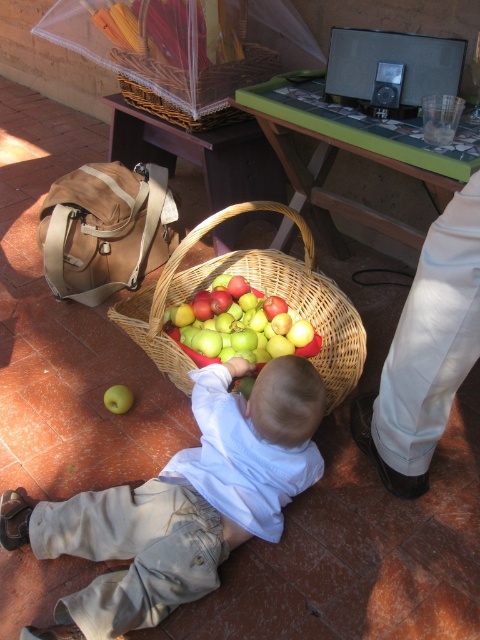
Looking at this image, which is more to the right, light beige cotton pants at lower left or green matte apple at lower left?

From the viewer's perspective, light beige cotton pants at lower left appears more on the right side.

Is light beige cotton pants at lower left to the left of green matte apple at lower left from the viewer's perspective?

No, light beige cotton pants at lower left is not to the left of green matte apple at lower left.

Where is `light beige cotton pants at lower left`? light beige cotton pants at lower left is located at coordinates (181, 502).

Image resolution: width=480 pixels, height=640 pixels. I want to click on light beige cotton pants at lower left, so click(x=181, y=502).

Looking at this image, can you confirm if shiny green apples at center is positioned below green matte apple at lower left?

No, shiny green apples at center is not below green matte apple at lower left.

Is shiny green apples at center bigger than green matte apple at lower left?

Indeed, shiny green apples at center has a larger size compared to green matte apple at lower left.

Does point (260, 358) come farther from viewer compared to point (128, 406)?

No.

Where is `shiny green apples at center`? This screenshot has width=480, height=640. shiny green apples at center is located at coordinates (240, 324).

Is shiny green apples at center positioned in front of woven brown basket at upper center?

Yes.

Is point (249, 289) positioned before point (118, 76)?

Yes, point (249, 289) is in front of point (118, 76).

The height and width of the screenshot is (640, 480). I want to click on shiny green apples at center, so click(x=240, y=324).